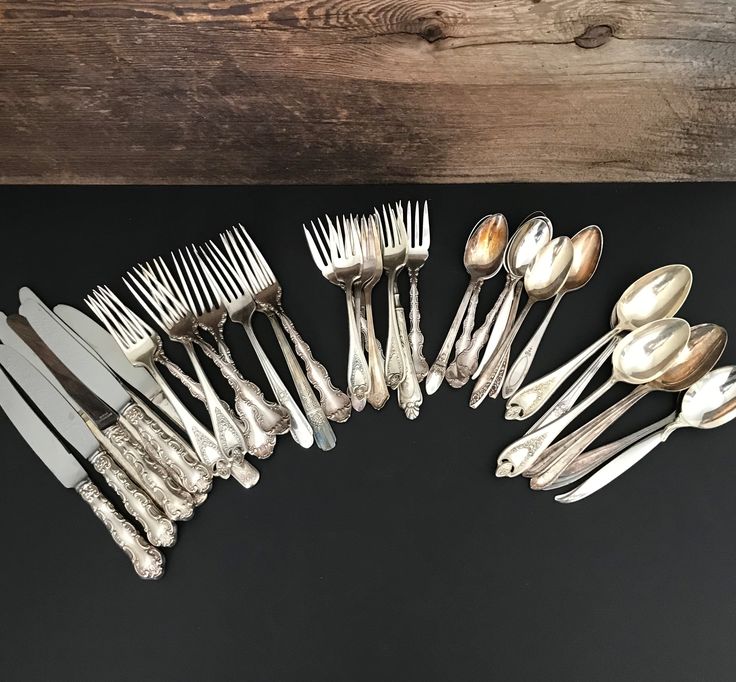
You are a GUI agent. You are given a task and a screenshot of the screen. Output one action in this format:
    pyautogui.click(x=<x>, y=<y>)
    Task: Click on the butter knives
    Image resolution: width=736 pixels, height=682 pixels.
    Given the screenshot: What is the action you would take?
    point(57,460), point(65,417), point(79,393), point(91,372), point(84,341), point(107,341), point(12,339)